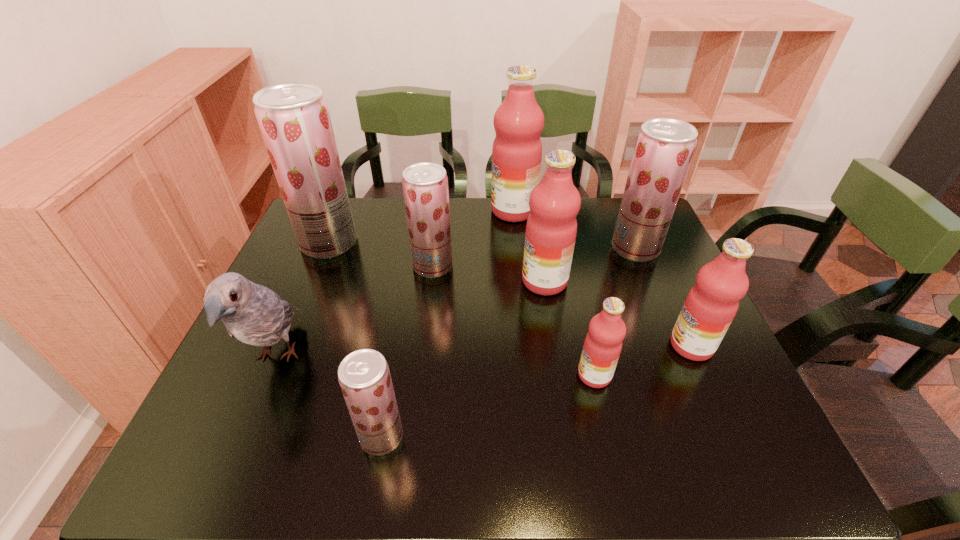
Locate an element on the screen. The image size is (960, 540). the nearest strawberry fruit juice is located at coordinates (364, 376).

The width and height of the screenshot is (960, 540). I want to click on the smallest strawberry fruit juice, so click(x=364, y=376).

What are the coordinates of `vacant region located on the label of the farthest pink fruit juice` in the screenshot? It's located at (377, 211).

This screenshot has height=540, width=960. Identify the location of blank space located 0.270m on the label of the farthest pink fruit juice. (410, 211).

What are the coordinates of `free region located 0.110m on the label of the farthest pink fruit juice` in the screenshot? It's located at (458, 211).

At what (x,y) coordinates should I click in order to perform the action: click on blank space located on the right of the biggest strawberry fruit juice. Please return your answer as a coordinate pair (x, y). This screenshot has height=540, width=960. Looking at the image, I should click on (479, 243).

Identify the location of free location located on the back of the third smallest strawberry fruit juice. (620, 213).

I want to click on vacant space located on the label of the second biggest pink fruit juice, so click(x=500, y=281).

You are a GUI agent. You are given a task and a screenshot of the screen. Output one action in this format:
    pyautogui.click(x=<x>, y=<y>)
    Task: Click on the free spot located on the label of the second biggest pink fruit juice
    This screenshot has width=960, height=540.
    Given the screenshot: What is the action you would take?
    (x=500, y=281)

The image size is (960, 540). I want to click on free space located on the label of the second biggest pink fruit juice, so tap(398, 281).